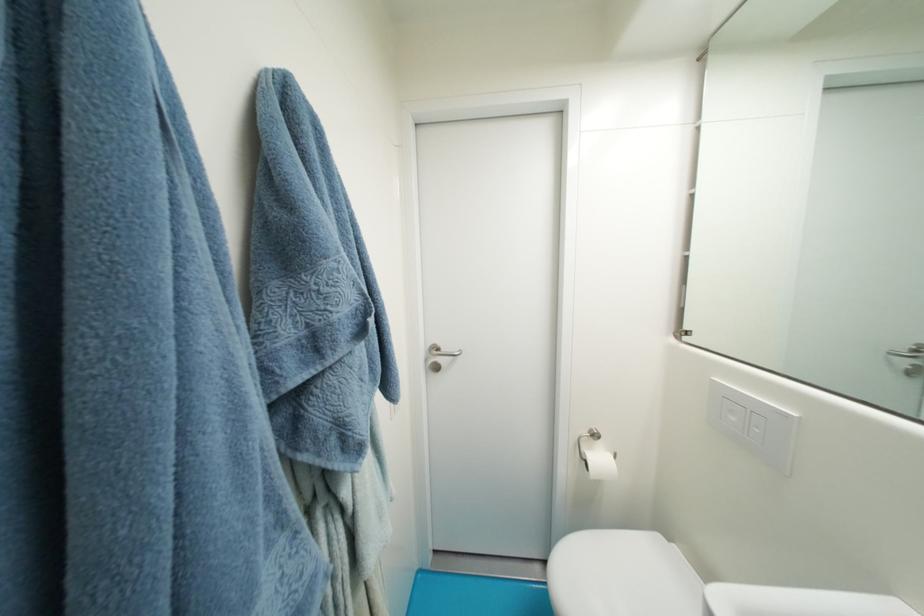
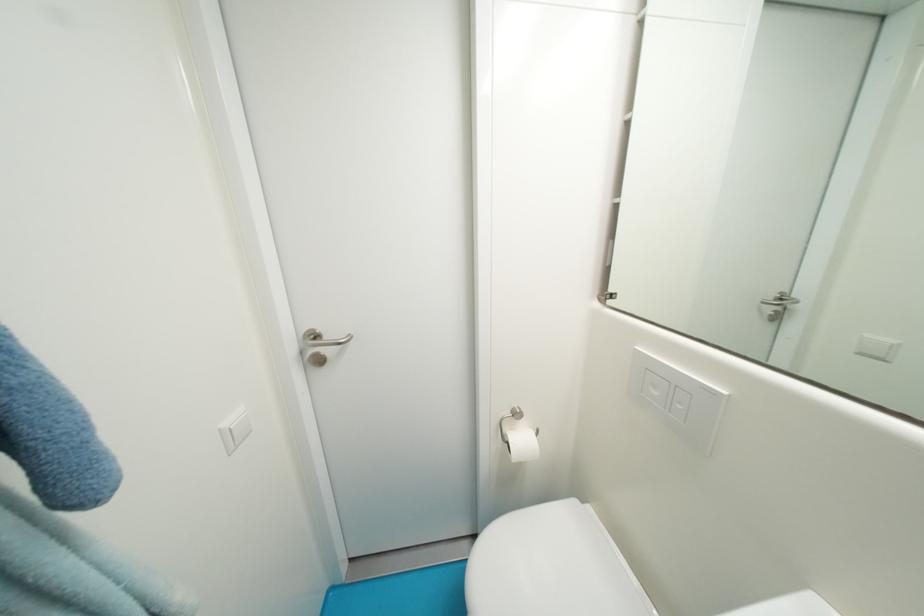
Find the pixel in the second image that matches the point at 445,351 in the first image.

(323, 339)